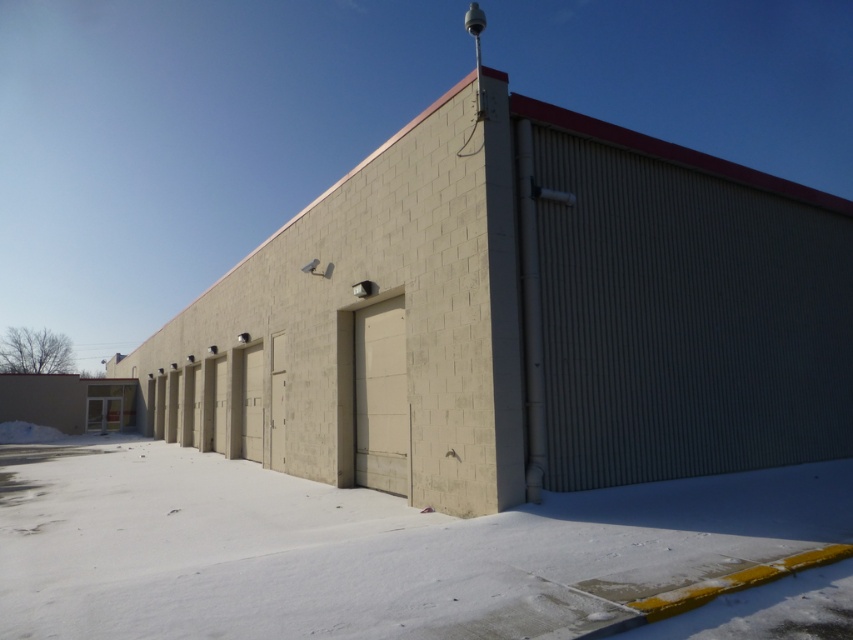
You are a delivery person trying to park your truck on the snowy ground in front of the building. The truck has a wheelbase that requires a surface area larger than the gray corrugated metal at right. Can the white powdery snow at lower center accommodate the truck?

The white powdery snow at lower center has a larger size compared to the gray corrugated metal at right, so yes, the white powdery snow at lower center can accommodate the truck as it is bigger in size than the gray corrugated metal at right.

You are a delivery person with a cart that is 10 feet wide. You need to move from the white powdery snow at lower center to the gray corrugated metal at right. Can your cart fit through the space between them?

The distance between the white powdery snow at lower center and the gray corrugated metal at right is 9.71 feet, which is less than the cart width of 10 feet. Therefore, the cart cannot fit through the space between them.